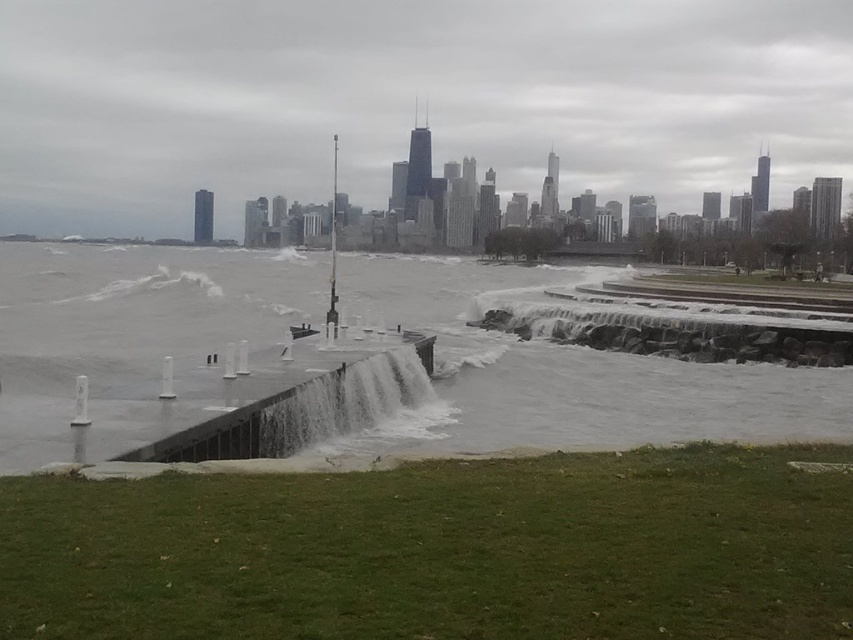
Question: Is clear concrete water at center to the left of gray concrete waterfall at center from the viewer's perspective?

Choices:
 (A) yes
 (B) no

Answer: (A)

Question: From the image, what is the correct spatial relationship of clear concrete water at center in relation to gray concrete waterfall at center?

Choices:
 (A) below
 (B) above

Answer: (B)

Question: Among these points, which one is nearest to the camera?

Choices:
 (A) (770, 390)
 (B) (340, 385)

Answer: (B)

Question: Is clear concrete water at center thinner than gray concrete waterfall at center?

Choices:
 (A) no
 (B) yes

Answer: (A)

Question: Which point is closer to the camera?

Choices:
 (A) (317, 435)
 (B) (10, 294)

Answer: (A)